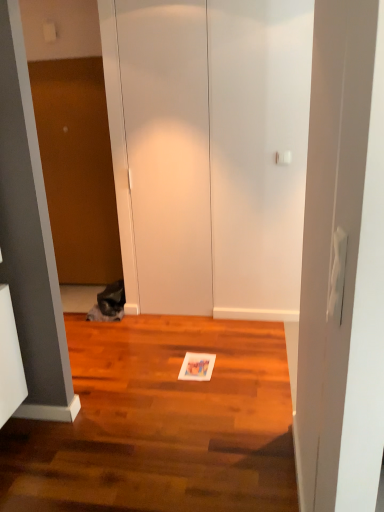
Identify the location of free space to the left of white matte door at center. (137, 325).